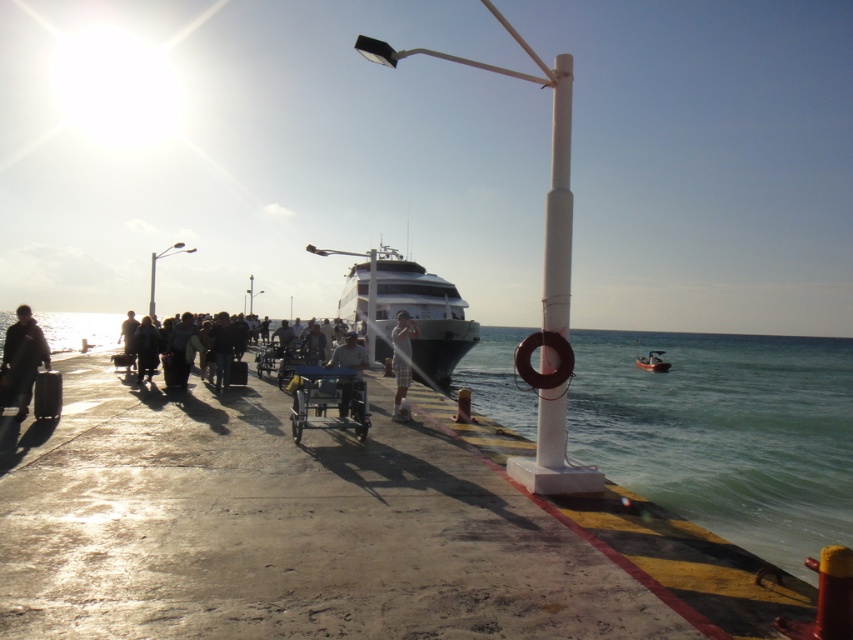
Can you confirm if concrete dock at center is positioned above white plastic pole at center?

No, concrete dock at center is not above white plastic pole at center.

Is point (291, 627) positioned in front of point (373, 358)?

Yes, point (291, 627) is in front of point (373, 358).

Measure the distance between concrete dock at center and camera.

concrete dock at center is 4.06 meters from camera.

Image resolution: width=853 pixels, height=640 pixels. In order to click on concrete dock at center in this screenshot , I will do `click(277, 525)`.

Can you confirm if white matte pole at center is bigger than white plastic lamp post at upper center?

No.

Which is more to the left, white matte pole at center or white plastic lamp post at upper center?

From the viewer's perspective, white plastic lamp post at upper center appears more on the left side.

Where is `white matte pole at center`? The width and height of the screenshot is (853, 640). white matte pole at center is located at coordinates (558, 204).

Where is `white matte pole at center`? Image resolution: width=853 pixels, height=640 pixels. white matte pole at center is located at coordinates (558, 204).

Can you confirm if white plastic lamp post at upper center is wider than white plastic lamp post at center?

Yes.

Which is behind, point (149, 257) or point (257, 291)?

The point (149, 257) is behind.

Is point (152, 292) positioned behind point (251, 314)?

Yes, point (152, 292) is behind point (251, 314).

Identify the location of white plastic lamp post at upper center. (154, 269).